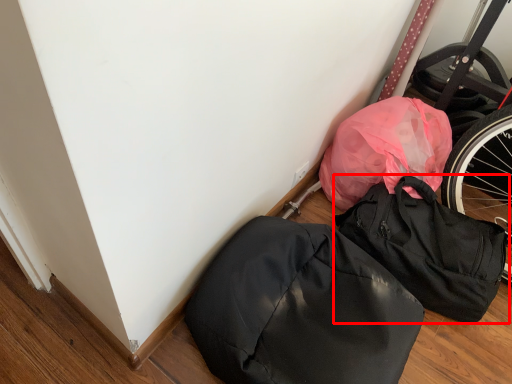
Question: Where is backpack (annotated by the red box) located in relation to backpack in the image?

Choices:
 (A) left
 (B) right

Answer: (B)